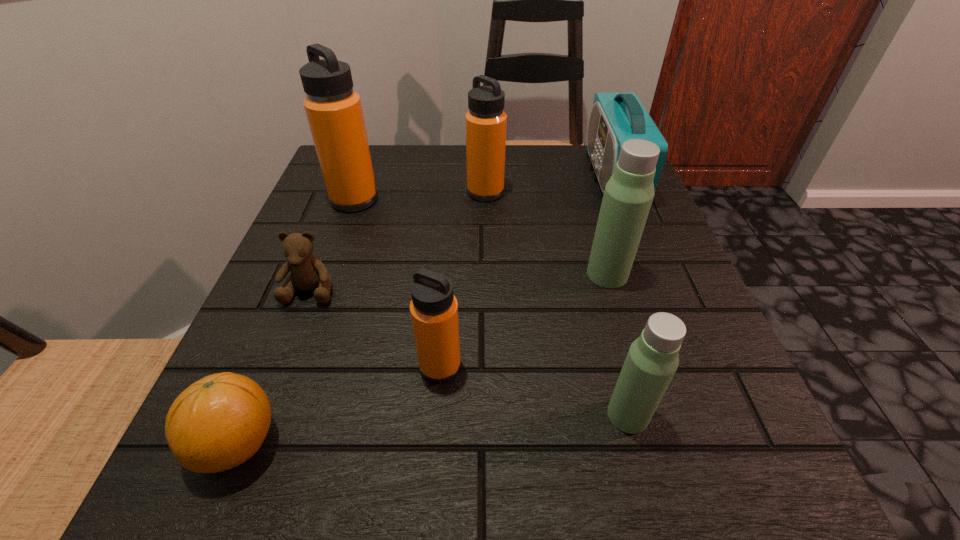
Find the location of a particular element. Image resolution: width=960 pixels, height=540 pixels. thermos bottle that is the third nearest to the nearer light thermos bottle is located at coordinates (486, 122).

Identify the location of thermos bottle that is the fourth nearest to the orange orange. The height and width of the screenshot is (540, 960). (628, 195).

Image resolution: width=960 pixels, height=540 pixels. I want to click on the second closest orange thermos bottle relative to the light radio receiver, so click(x=434, y=309).

Where is `the second closest orange thermos bottle to the teddy bear`? the second closest orange thermos bottle to the teddy bear is located at coordinates (434, 309).

This screenshot has width=960, height=540. Identify the location of blank area in the image that satisfies the following two spatial constraints: 1. on the front side of the bigger light thermos bottle; 2. on the right side of the leftmost thermos bottle. (327, 274).

At what (x,y) coordinates should I click in order to perform the action: click on vacant space that satisfies the following two spatial constraints: 1. on the front panel of the tallest object; 2. on the front side of the orange orange. Please return your answer as a coordinate pair (x, y). This screenshot has height=540, width=960. Looking at the image, I should click on (724, 443).